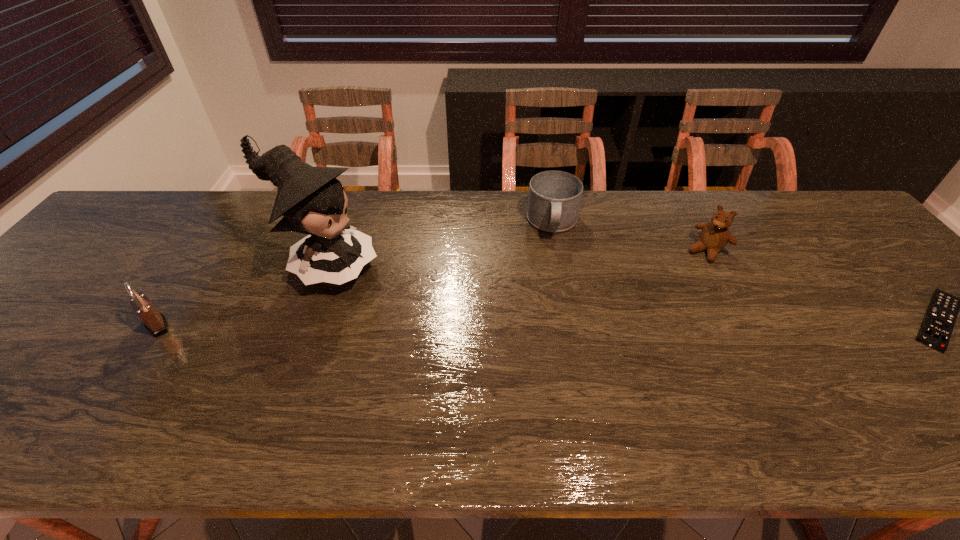
Identify the location of free space between the leftmost object and the teddy bear. This screenshot has height=540, width=960. (432, 288).

This screenshot has width=960, height=540. Find the location of `unoccupied position between the teddy bear and the padlock`. unoccupied position between the teddy bear and the padlock is located at coordinates click(432, 288).

Locate an element on the screen. This screenshot has height=540, width=960. unoccupied area between the leftmost object and the teddy bear is located at coordinates (432, 288).

The image size is (960, 540). I want to click on vacant area that lies between the doll and the mug, so click(439, 246).

What are the coordinates of `blank region between the doll and the padlock` in the screenshot? It's located at (241, 296).

Locate an element on the screen. the fourth closest object relative to the mug is located at coordinates (155, 322).

In order to click on object that ranks as the second closest to the shortest object in this screenshot , I will do `click(554, 199)`.

Find the location of a particular element. The width and height of the screenshot is (960, 540). free spot that satisfies the following two spatial constraints: 1. on the back side of the tallest object; 2. on the right side of the padlock is located at coordinates (195, 268).